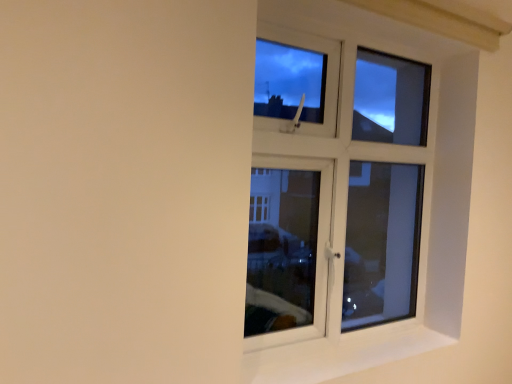
Question: Choose the correct answer: Is white plastic window at upper right inside white smooth window sill at right or outside it?

Choices:
 (A) outside
 (B) inside

Answer: (A)

Question: From the image's perspective, is white plastic window at upper right located above or below white smooth window sill at right?

Choices:
 (A) above
 (B) below

Answer: (A)

Question: Considering the positions of white plastic window at upper right and white smooth window sill at right in the image, is white plastic window at upper right taller or shorter than white smooth window sill at right?

Choices:
 (A) short
 (B) tall

Answer: (B)

Question: In terms of size, does white smooth window sill at right appear bigger or smaller than white plastic window at upper right?

Choices:
 (A) big
 (B) small

Answer: (B)

Question: Is white smooth window sill at right wider or thinner than white plastic window at upper right?

Choices:
 (A) thin
 (B) wide

Answer: (B)

Question: Do you think white smooth window sill at right is within white plastic window at upper right, or outside of it?

Choices:
 (A) inside
 (B) outside

Answer: (B)

Question: From the image's perspective, is white smooth window sill at right above or below white plastic window at upper right?

Choices:
 (A) below
 (B) above

Answer: (A)